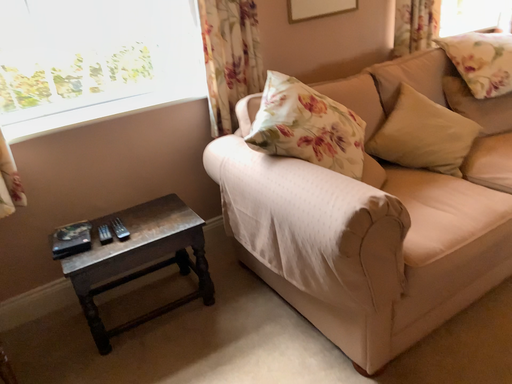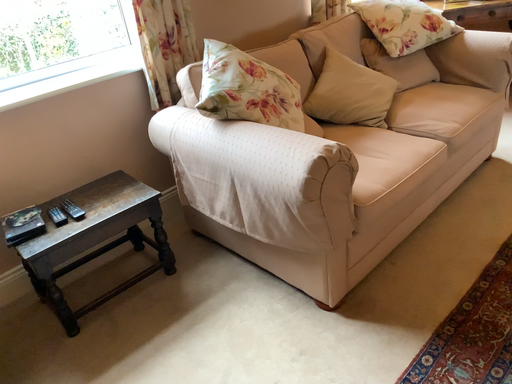
Question: Which way did the camera rotate in the video?

Choices:
 (A) rotated right
 (B) rotated left

Answer: (A)